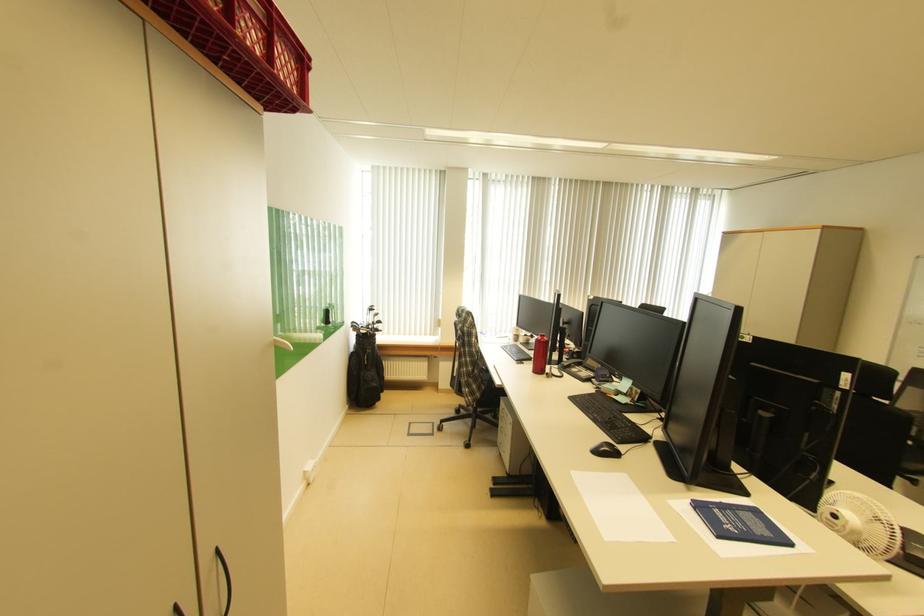
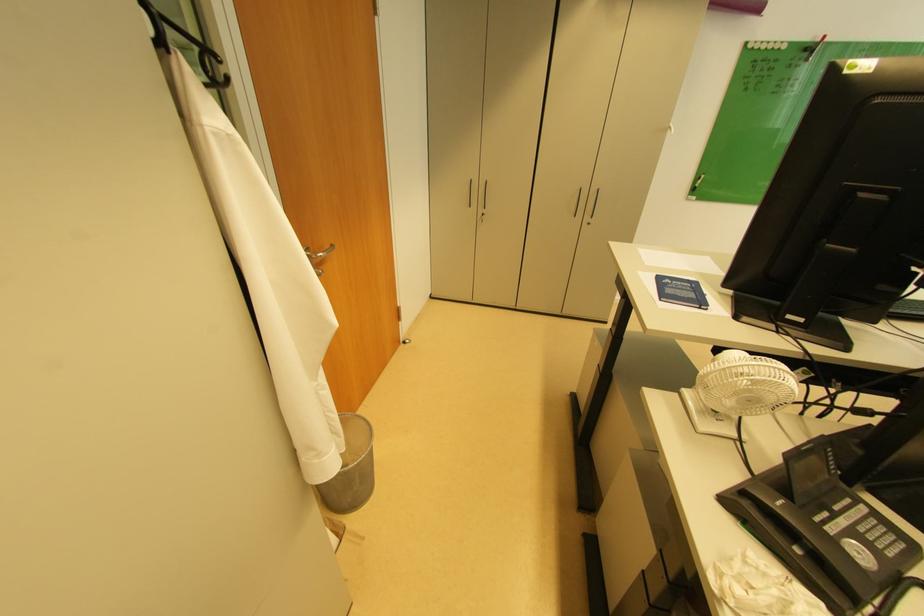
Find the pixel in the second image that matches point (725, 513) in the first image.

(697, 286)